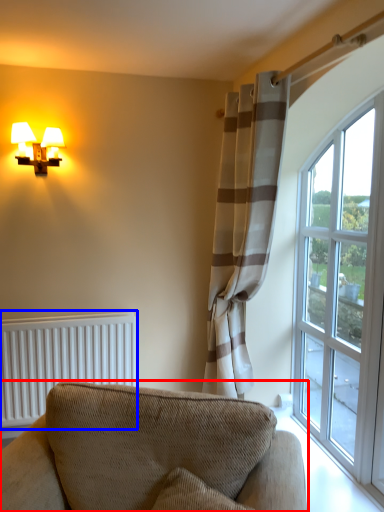
Question: Among these objects, which one is nearest to the camera, studio couch (highlighted by a red box) or radiator (highlighted by a blue box)?

Choices:
 (A) studio couch
 (B) radiator

Answer: (A)